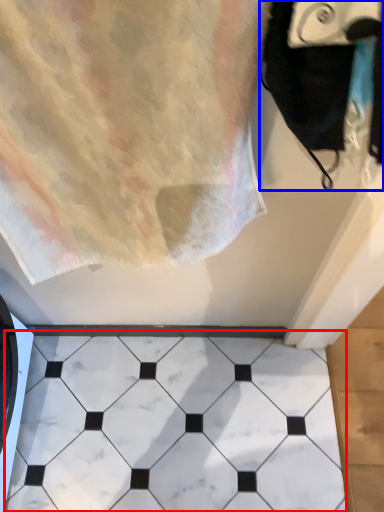
Question: Which of the following is the farthest to the observer, marble (highlighted by a red box) or bath towel (highlighted by a blue box)?

Choices:
 (A) marble
 (B) bath towel

Answer: (A)